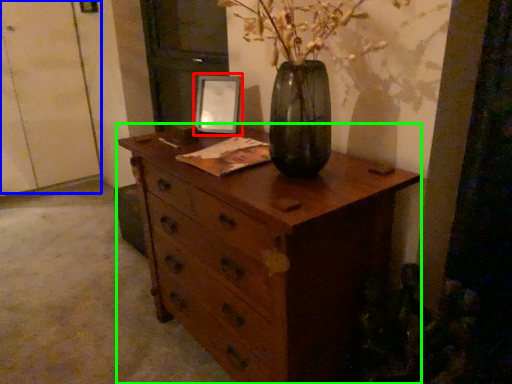
Question: Which object is the farthest from picture frame (highlighted by a red box)? Choose among these: door (highlighted by a blue box) or chest of drawers (highlighted by a green box).

Choices:
 (A) door
 (B) chest of drawers

Answer: (A)